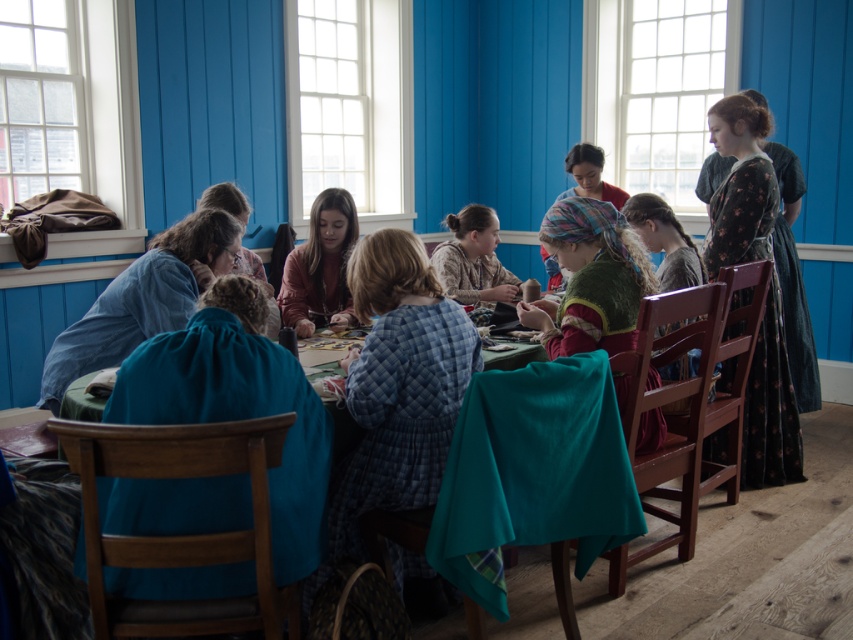
Which of these two, floral dress at center or multicolored fabric headscarf at center, stands shorter?

Standing shorter between the two is multicolored fabric headscarf at center.

Between point (662, 326) and point (596, 156), which one is positioned behind?

The point (596, 156) is more distant.

The image size is (853, 640). Describe the element at coordinates (664, 241) in the screenshot. I see `floral dress at center` at that location.

Where is `floral dress at center`? The height and width of the screenshot is (640, 853). floral dress at center is located at coordinates 664,241.

In the scene shown: Does matte brown sweater at center have a larger size compared to floral dress at center?

No.

Describe the element at coordinates (321, 268) in the screenshot. I see `matte brown sweater at center` at that location.

Locate an element on the screen. Image resolution: width=853 pixels, height=640 pixels. matte brown sweater at center is located at coordinates (321, 268).

Can you confirm if velvet green dress at center is taller than blue quilted dress at center?

Indeed, velvet green dress at center has a greater height compared to blue quilted dress at center.

Who is more forward, (578, 218) or (148, 320)?

Point (578, 218) is in front.

Who is more distant from viewer, (608,314) or (44,403)?

The point (44,403) is behind.

Find the location of a particular element. velvet green dress at center is located at coordinates (590, 280).